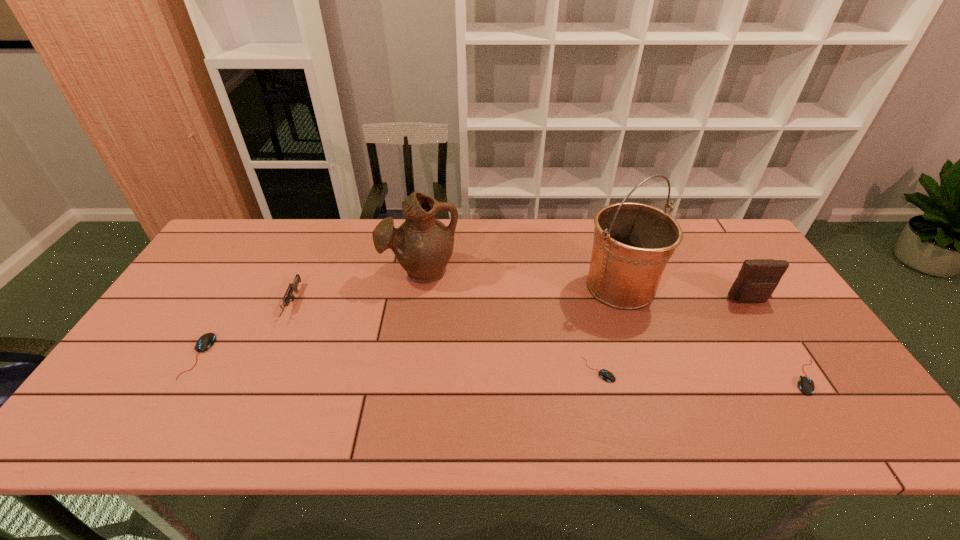
Locate an element on the screen. The width and height of the screenshot is (960, 540). the leftmost mouse is located at coordinates (207, 340).

Where is `the leftmost object`? This screenshot has height=540, width=960. the leftmost object is located at coordinates (207, 340).

Find the location of a particular element. the shortest mouse is located at coordinates (607, 376).

You are a GUI agent. You are given a task and a screenshot of the screen. Output one action in this format:
    pyautogui.click(x=<x>, y=<y>)
    Task: Click on the second mouse from left to right
    
    Given the screenshot: What is the action you would take?
    pyautogui.click(x=607, y=376)

This screenshot has height=540, width=960. Find the location of `the rightmost mouse`. the rightmost mouse is located at coordinates (806, 385).

This screenshot has width=960, height=540. What are the coordinates of `the second shortest object` in the screenshot? It's located at 806,385.

Find the location of a particular element. The width and height of the screenshot is (960, 540). pitcher is located at coordinates (423, 245).

Locate an element on the screen. This screenshot has height=540, width=960. the second tallest object is located at coordinates (x=423, y=245).

This screenshot has height=540, width=960. Find the location of `gun`. gun is located at coordinates (293, 286).

Locate an element on the screen. Image resolution: width=960 pixels, height=540 pixels. the fourth shortest object is located at coordinates (293, 286).